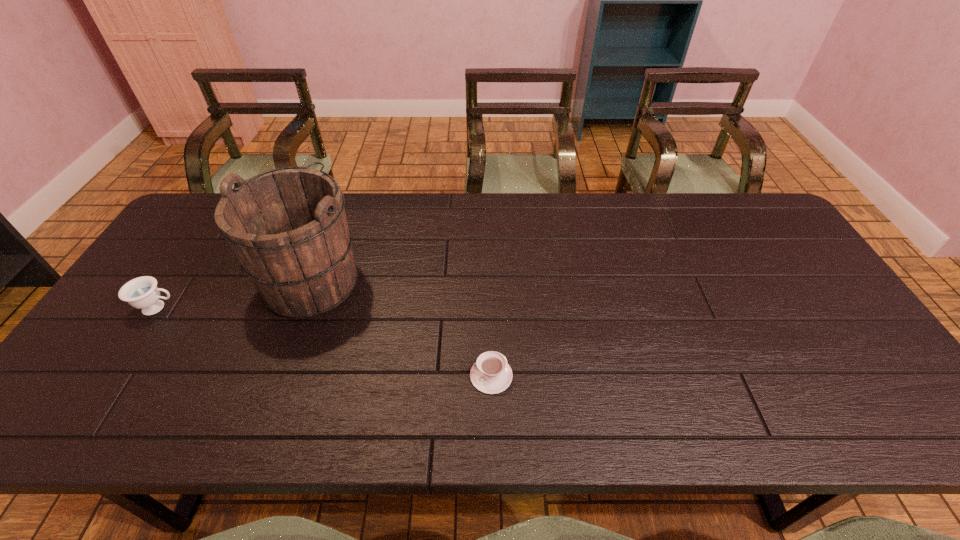
The width and height of the screenshot is (960, 540). I want to click on free region located 0.070m on the handle side of the nearer teacup, so click(x=440, y=376).

Locate an element on the screen. Image resolution: width=960 pixels, height=540 pixels. object located in the left edge section of the desktop is located at coordinates (142, 293).

Locate an element on the screen. The width and height of the screenshot is (960, 540). free region at the far edge is located at coordinates (422, 207).

In the image, there is a desktop. Where is `free region at the near edge`? The image size is (960, 540). free region at the near edge is located at coordinates (209, 416).

At what (x,y) coordinates should I click in order to perform the action: click on vacant space at the left edge of the desktop. Please return your answer as a coordinate pair (x, y). The image size is (960, 540). Looking at the image, I should click on (179, 278).

In the image, there is a desktop. Where is `free space at the right edge`? free space at the right edge is located at coordinates (809, 332).

Where is `vacant space at the far right corner of the desktop`? This screenshot has height=540, width=960. vacant space at the far right corner of the desktop is located at coordinates click(730, 218).

Locate an element on the screen. blank region between the nearest object and the farther teacup is located at coordinates (324, 342).

Where is `vacant point located between the left teacup and the tallest object`? vacant point located between the left teacup and the tallest object is located at coordinates (235, 294).

Find the location of a particular element. The height and width of the screenshot is (540, 960). blank region between the bucket and the shorter teacup is located at coordinates (402, 328).